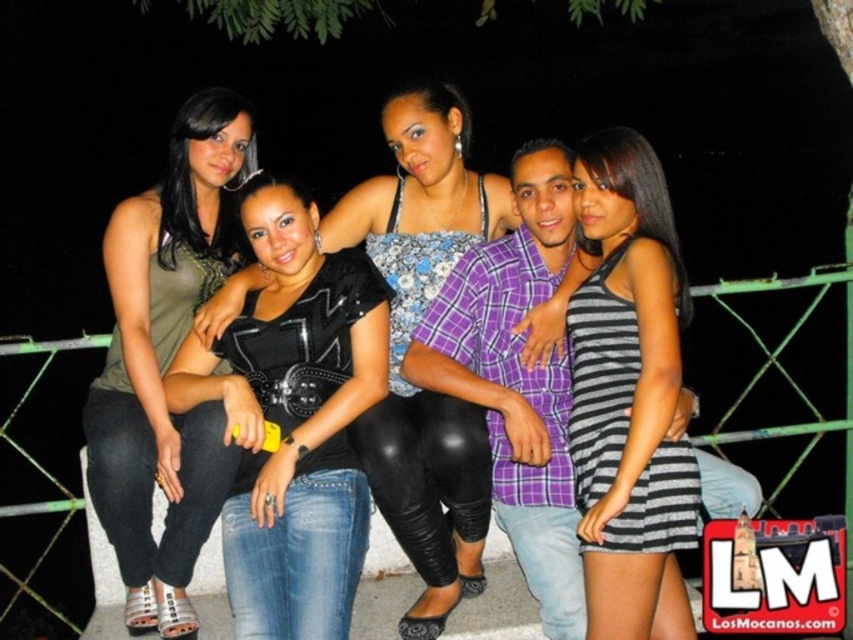
Question: Is striped fabric dress at right to the right of floral-patterned fabric dress at center from the viewer's perspective?

Choices:
 (A) yes
 (B) no

Answer: (A)

Question: Which object appears closest to the camera in this image?

Choices:
 (A) floral-patterned fabric dress at center
 (B) black leather top at center
 (C) matte green tank top at left

Answer: (B)

Question: Can you confirm if black leather top at center is positioned below floral-patterned fabric dress at center?

Choices:
 (A) yes
 (B) no

Answer: (A)

Question: Which object is the closest to the floral-patterned fabric dress at center?

Choices:
 (A) striped fabric dress at right
 (B) striped fabric dress at center

Answer: (B)

Question: Does matte green tank top at left have a larger size compared to striped fabric dress at right?

Choices:
 (A) yes
 (B) no

Answer: (A)

Question: Among these points, which one is farthest from the camera?

Choices:
 (A) (242, 572)
 (B) (473, 448)

Answer: (B)